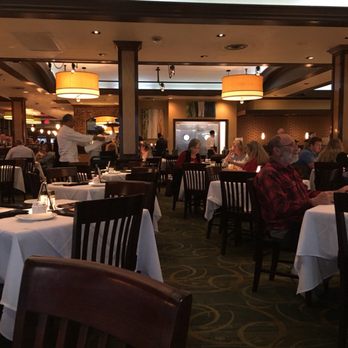
Where is `door`? Image resolution: width=348 pixels, height=348 pixels. door is located at coordinates (181, 128), (204, 131).